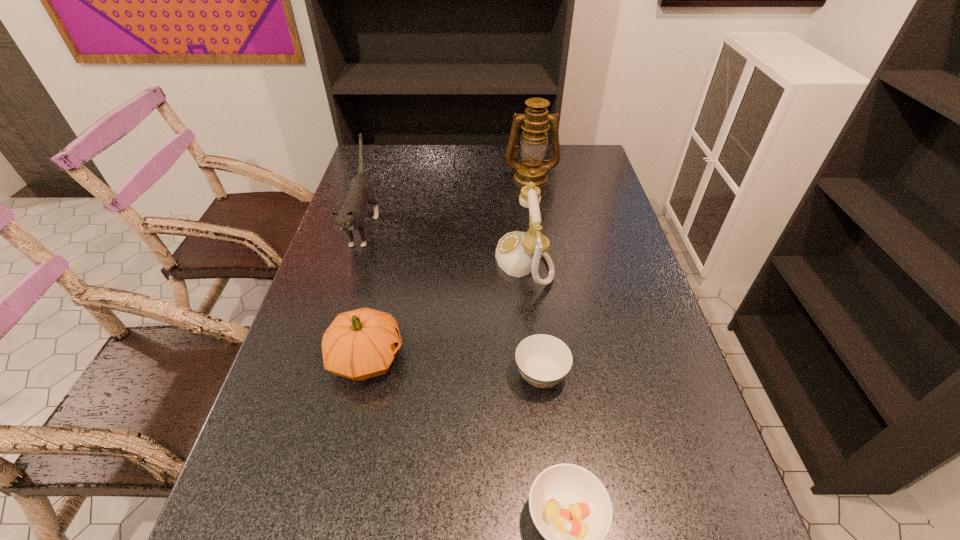
At what (x,y) coordinates should I click in order to perform the action: click on empty space between the farther soup bowl and the second tallest object. Please return your answer as a coordinate pair (x, y). Image resolution: width=960 pixels, height=540 pixels. Looking at the image, I should click on (452, 301).

The width and height of the screenshot is (960, 540). Find the location of `vacant area that lies between the telephone and the farthest object`. vacant area that lies between the telephone and the farthest object is located at coordinates (527, 219).

Find the location of a particular element. vacant area that lies between the cat and the fourth shortest object is located at coordinates (444, 244).

Identify the location of vacant region between the farthest object and the telephone. The width and height of the screenshot is (960, 540). (527, 219).

What are the coordinates of `vacant space that's between the fifth shortest object and the oil lamp` in the screenshot? It's located at (447, 203).

The height and width of the screenshot is (540, 960). I want to click on vacant space that is in between the fourth shortest object and the second tallest object, so click(x=444, y=244).

Find the location of a particular element. The width and height of the screenshot is (960, 540). free spot between the farther soup bowl and the fifth shortest object is located at coordinates (452, 301).

The width and height of the screenshot is (960, 540). In order to click on object that is the fifth closest to the cat in this screenshot , I will do `click(571, 508)`.

The image size is (960, 540). In order to click on object that stands as the third closest to the fourth tallest object in this screenshot , I will do `click(543, 360)`.

The height and width of the screenshot is (540, 960). What are the coordinates of `free space that satisfies the following two spatial constraints: 1. on the back side of the farther soup bowl; 2. on the dial of the fourth shortest object` in the screenshot? It's located at (527, 260).